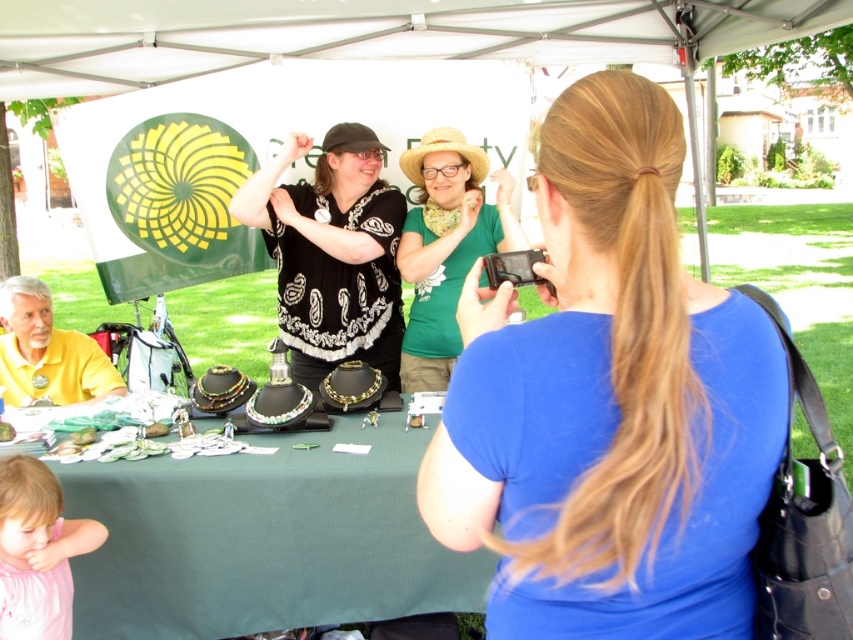
Which of these two, blue fabric shirt at center or black paisley blouse at center, stands taller?

black paisley blouse at center

Is point (674, 308) closer to camera compared to point (395, 316)?

Yes.

This screenshot has width=853, height=640. Identify the location of blue fabric shirt at center. (610, 401).

Is black paisley blouse at center above pink fabric shirt at lower left?

Yes, black paisley blouse at center is above pink fabric shirt at lower left.

Who is shorter, black paisley blouse at center or pink fabric shirt at lower left?

Standing shorter between the two is pink fabric shirt at lower left.

Which is behind, point (395, 316) or point (48, 563)?

The point (395, 316) is more distant.

Locate an element on the screen. black paisley blouse at center is located at coordinates (332, 253).

Can you confirm if green matte shirt at center is positioned above pink fabric shirt at lower left?

Correct, green matte shirt at center is located above pink fabric shirt at lower left.

Which is in front, point (459, 269) or point (39, 500)?

Point (39, 500) is in front.

Identify the location of green matte shirt at center. The height and width of the screenshot is (640, 853). (445, 246).